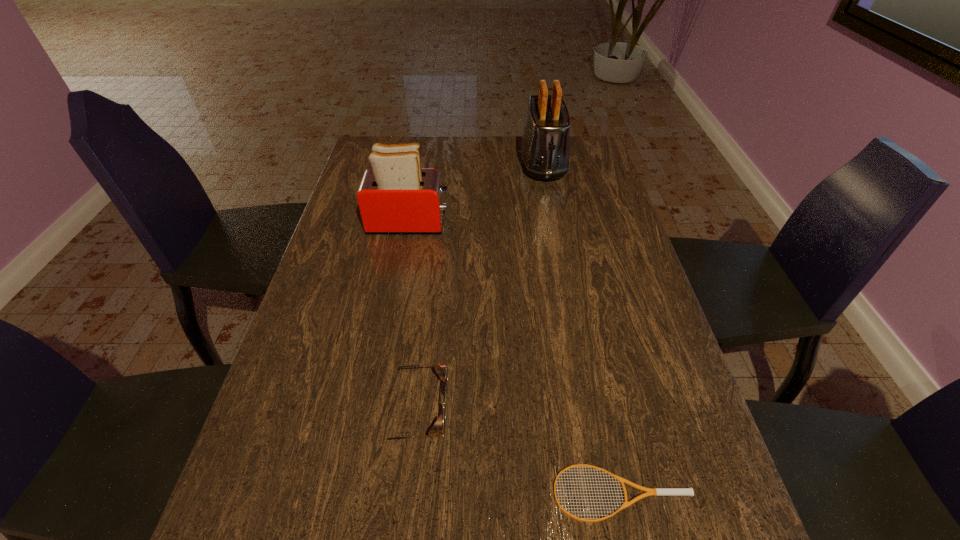
You are a GUI agent. You are given a task and a screenshot of the screen. Output one action in this format:
    pyautogui.click(x=<x>, y=<y>)
    Task: Click on the vacant space that satisfies the following two spatial constraints: 1. on the side of the farthest object with the control lever; 2. on the front lenses of the third tallest object
    The height and width of the screenshot is (540, 960).
    Given the screenshot: What is the action you would take?
    pyautogui.click(x=591, y=411)

Identify the location of vacant region that satisfies the following two spatial constraints: 1. on the side of the shortest object with the control lever; 2. on the left side of the farthest object. (607, 493).

You are a GUI agent. You are given a task and a screenshot of the screen. Output one action in this format:
    pyautogui.click(x=<x>, y=<y>)
    Task: Click on the vacant position in the image that satisfies the following two spatial constraints: 1. on the side of the tennis racket with the control lever; 2. on the left side of the farthest object
    
    Given the screenshot: What is the action you would take?
    pyautogui.click(x=607, y=493)